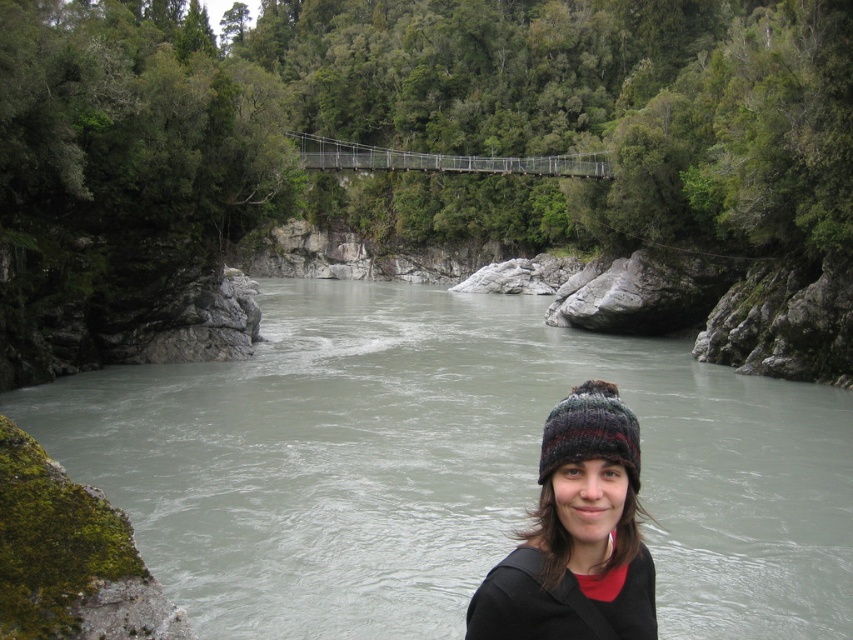
Question: Which object appears closest to the camera in this image?

Choices:
 (A) multicolored knitted beanie at lower center
 (B) black knitted hat at center

Answer: (B)

Question: Can you confirm if multicolored knitted beanie at lower center is positioned to the right of metallic wire suspension bridge at center?

Choices:
 (A) yes
 (B) no

Answer: (A)

Question: Which object is closer to the camera taking this photo?

Choices:
 (A) multicolored knitted beanie at lower center
 (B) black knitted hat at center
 (C) metallic wire suspension bridge at center

Answer: (B)

Question: Where is black knitted hat at center located in relation to metallic wire suspension bridge at center in the image?

Choices:
 (A) below
 (B) above

Answer: (A)

Question: Does multicolored knitted beanie at lower center have a smaller size compared to metallic wire suspension bridge at center?

Choices:
 (A) yes
 (B) no

Answer: (A)

Question: Among these objects, which one is nearest to the camera?

Choices:
 (A) black knitted hat at center
 (B) metallic wire suspension bridge at center
 (C) gray smooth water at center
 (D) multicolored knitted beanie at lower center

Answer: (A)